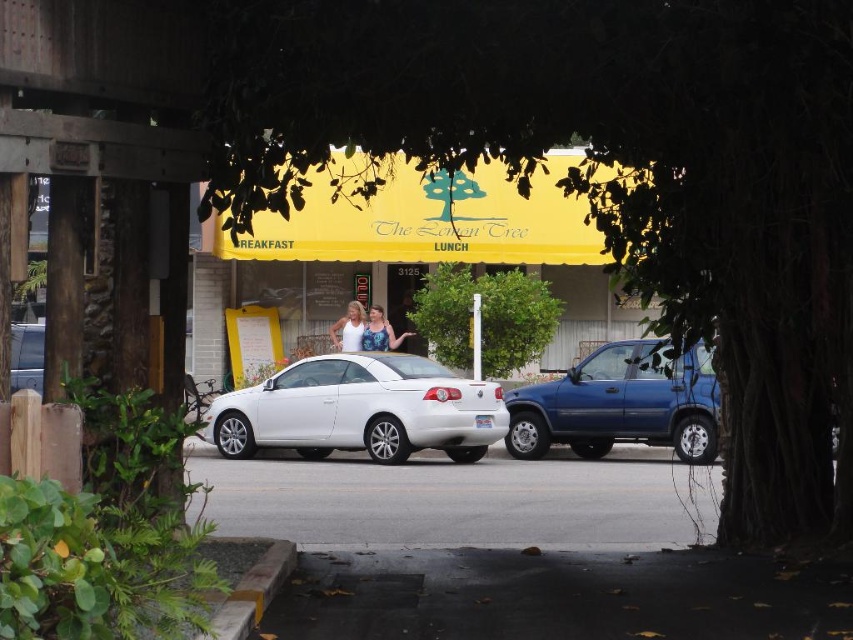
You are a pedestrian standing on the sidewalk in front of The Lemon Tree. You want to walk to the blue SUV parked at the right. Which object, the green leafy tree at center or the metallic silver sedan at left, would you have to go around first?

The green leafy tree at center is in front of the metallic silver sedan at left, so you would have to go around the green leafy tree at center first before reaching the metallic silver sedan at left.

You are a delivery person who needs to load a package onto the roof of the white glossy convertible at center. The package is 1.5 meters tall. Can you safely place it there without hitting the white matte tank top at center?

The white glossy convertible at center is much taller than the white matte tank top at center, so placing a 1.5 meter tall package on its roof would risk hitting the tank top. Choose a different location for the package.

You are a pedestrian standing on the sidewalk in front of The Lemon Tree. You see the green leafy tree at center and the metallic silver sedan at left. Which object is positioned higher from the ground?

The green leafy tree at center is located above the metallic silver sedan at left, so it is positioned higher from the ground.